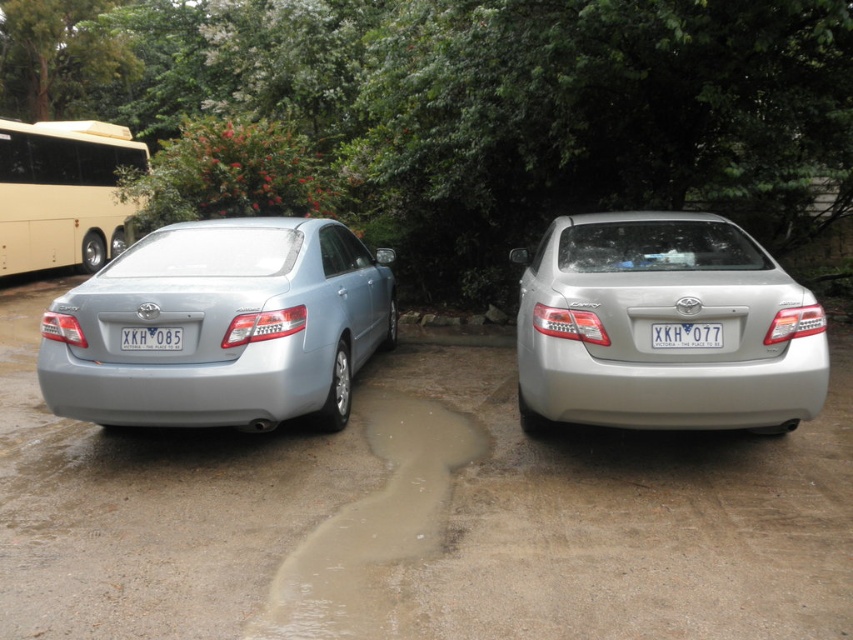
You are standing in front of two parked cars in a parking lot. You see two points marked on the ground between them. The first point is at coordinate point (793, 406) and the second is at point (390, 413). If you want to step on the point that is closer to you, which coordinate should you choose?

The point at coordinate (793, 406) is closer to the camera, so you should step on point (793, 406).

You are a delivery person trying to park your van between the two cars in the parking lot. The parking spot you want is between the light blue sedan and the satin silver sedan at right. According to the coordinates provided, can you fit your van which requires a 1.2 meter gap between the cars?

The satin silver sedan at right is located at point (663, 321). However, without knowing the exact distance between the two cars, it is impossible to determine if there is enough space for the van. Please check the distance between the cars first.